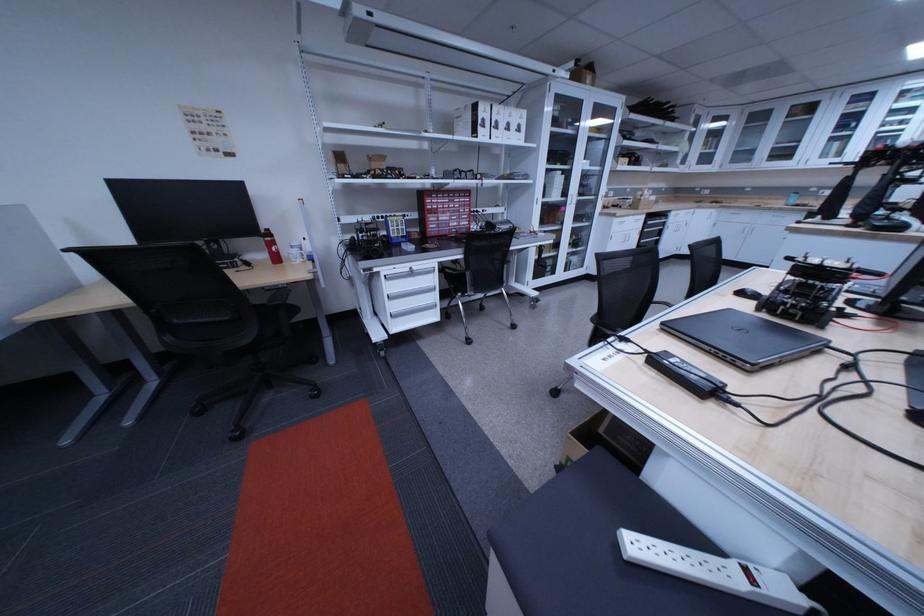
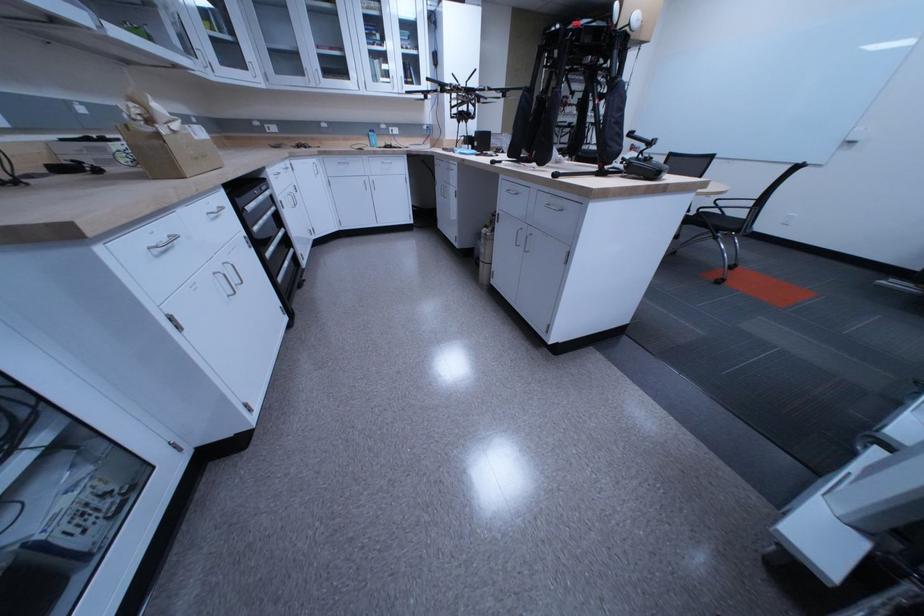
Find the pixel in the second image that matches the point at 840,156 in the first image.

(390, 79)